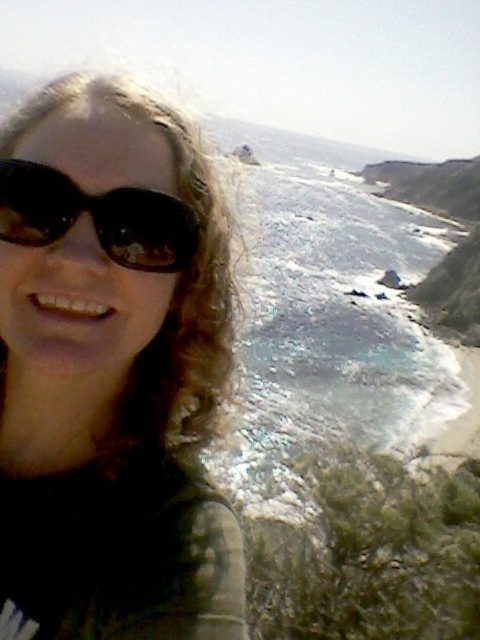
Describe the element at coordinates (122, 376) in the screenshot. I see `matte black sunglasses at upper left` at that location.

Is matte black sunglasses at upper left to the left of black matte sunglasses at upper left from the viewer's perspective?

No, matte black sunglasses at upper left is not to the left of black matte sunglasses at upper left.

The image size is (480, 640). In order to click on matte black sunglasses at upper left in this screenshot , I will do `click(122, 376)`.